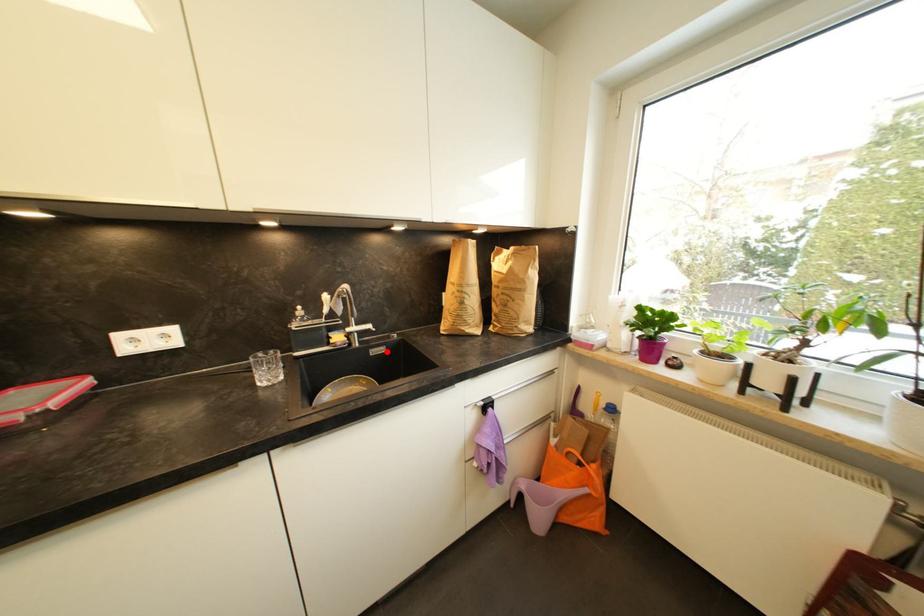
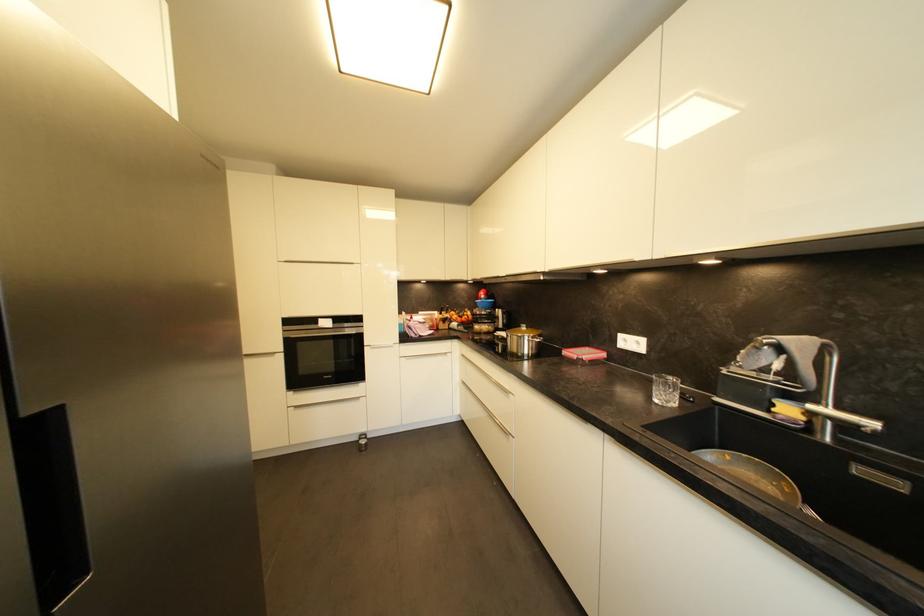
The point at the highlighted location is marked in the first image. Where is the corresponding point in the second image?

(904, 487)